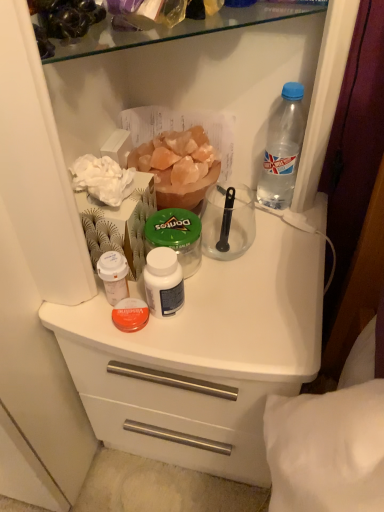
Question: From a real-world perspective, is transparent plastic bottle at upper right, arranged as the 1th bottle when viewed from the top, located beneath white matte plastic counter at center?

Choices:
 (A) no
 (B) yes

Answer: (A)

Question: From the image's perspective, is transparent plastic bottle at upper right, the 2th bottle ordered from the bottom, below white matte plastic counter at center?

Choices:
 (A) no
 (B) yes

Answer: (A)

Question: Is transparent plastic bottle at upper right, placed as the first bottle when sorted from right to left, positioned in front of white matte plastic counter at center?

Choices:
 (A) no
 (B) yes

Answer: (A)

Question: Is transparent plastic bottle at upper right, the 2th bottle from the left, oriented away from white matte plastic counter at center?

Choices:
 (A) yes
 (B) no

Answer: (B)

Question: Considering the relative positions of transparent plastic bottle at upper right, the 2th bottle ordered from the bottom, and white matte plastic counter at center in the image provided, is transparent plastic bottle at upper right, the 2th bottle ordered from the bottom, to the right of white matte plastic counter at center from the viewer's perspective?

Choices:
 (A) yes
 (B) no

Answer: (A)

Question: Does transparent plastic bottle at upper right, placed as the first bottle when sorted from right to left, have a greater width compared to white matte plastic counter at center?

Choices:
 (A) no
 (B) yes

Answer: (A)

Question: Is transparent plastic bottle at upper right, arranged as the 1th bottle when viewed from the top, oriented towards white matte jar at center?

Choices:
 (A) no
 (B) yes

Answer: (A)

Question: Is transparent plastic bottle at upper right, arranged as the 1th bottle when viewed from the top, completely or partially outside of white matte jar at center?

Choices:
 (A) no
 (B) yes

Answer: (B)

Question: Is transparent plastic bottle at upper right, the 2th bottle from the left, looking in the opposite direction of white matte jar at center?

Choices:
 (A) yes
 (B) no

Answer: (B)

Question: Is transparent plastic bottle at upper right, placed as the first bottle when sorted from right to left, to the right of white matte jar at center from the viewer's perspective?

Choices:
 (A) no
 (B) yes

Answer: (B)

Question: Is transparent plastic bottle at upper right, the 2th bottle ordered from the bottom, smaller than white matte jar at center?

Choices:
 (A) no
 (B) yes

Answer: (A)

Question: Is white matte jar at center located within transparent plastic bottle at upper right, arranged as the 1th bottle when viewed from the top?

Choices:
 (A) yes
 (B) no

Answer: (B)

Question: Is green plastic jar at center positioned with its back to white matte plastic counter at center?

Choices:
 (A) no
 (B) yes

Answer: (A)